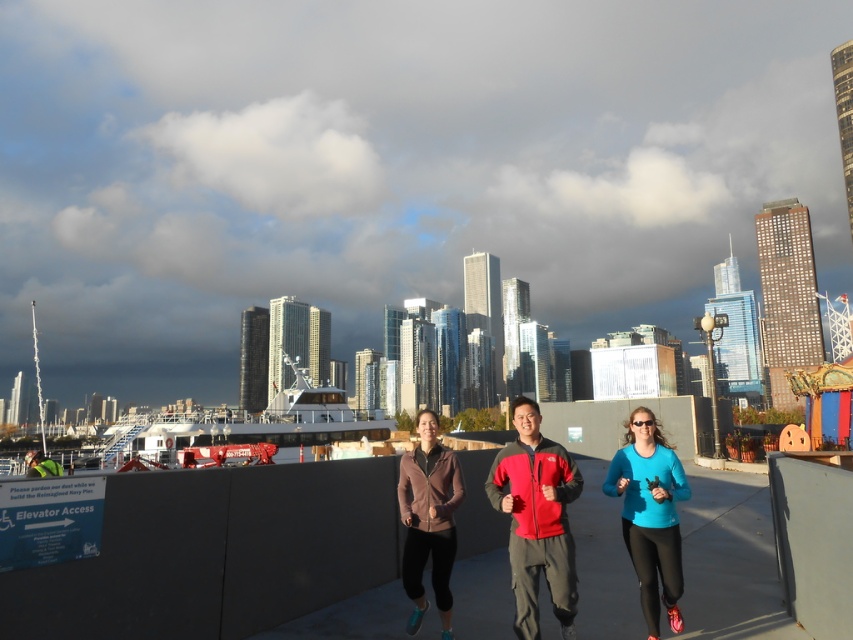
Is point (631, 412) in front of point (410, 538)?

That is False.

In the scene shown: Between matte blue top at center and matte pink jacket at center, which one appears on the left side from the viewer's perspective?

matte pink jacket at center is more to the left.

Between point (627, 513) and point (422, 509), which one is positioned in front?

Point (627, 513) is in front.

I want to click on matte blue top at center, so coord(650,515).